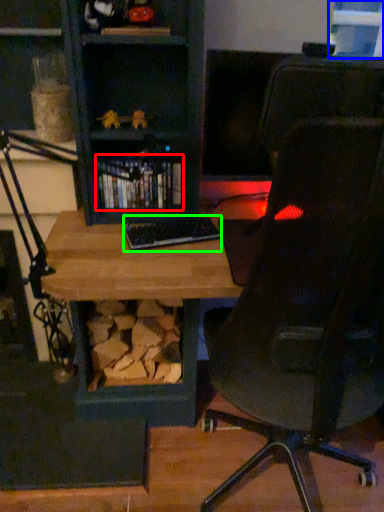
Question: Considering the real-world distances, which object is farthest from book (highlighted by a red box)? window (highlighted by a blue box) or keyboard (highlighted by a green box)?

Choices:
 (A) window
 (B) keyboard

Answer: (A)